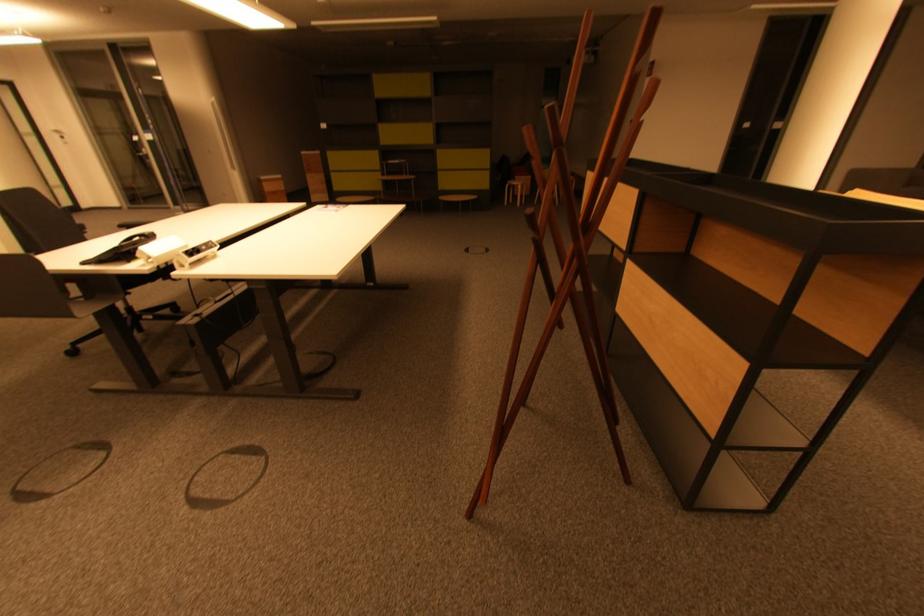
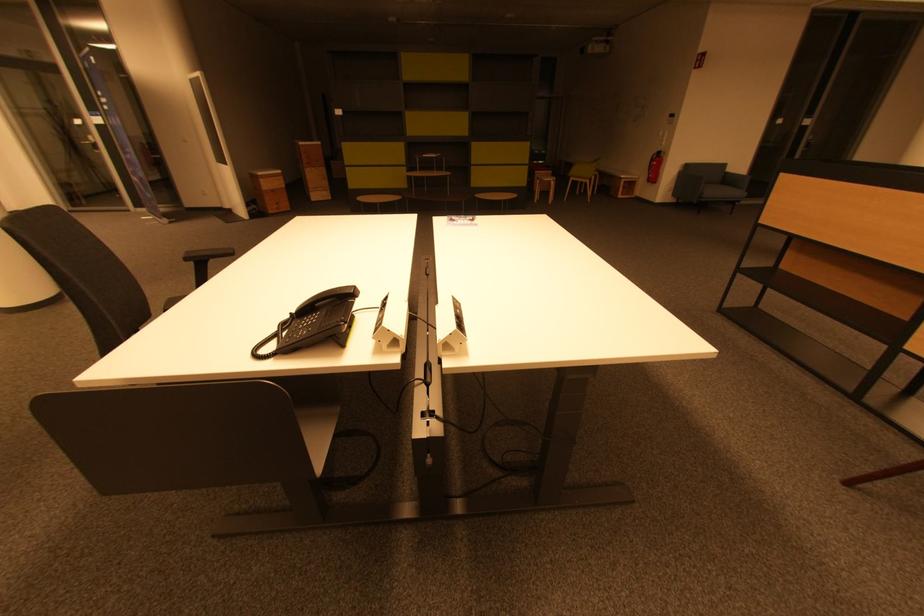
The images are taken continuously from a first-person perspective. In which direction are you moving?

The cameraman moved toward left, forward.